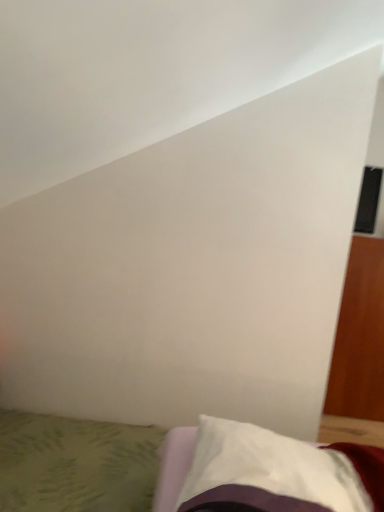
Question: Is white soft pillow at lower right in front of white fabric bed at lower center?

Choices:
 (A) yes
 (B) no

Answer: (A)

Question: Does white soft pillow at lower right turn towards white fabric bed at lower center?

Choices:
 (A) yes
 (B) no

Answer: (B)

Question: Does white soft pillow at lower right appear on the right side of white fabric bed at lower center?

Choices:
 (A) no
 (B) yes

Answer: (B)

Question: From the image's perspective, is white soft pillow at lower right on white fabric bed at lower center?

Choices:
 (A) yes
 (B) no

Answer: (A)

Question: Is white fabric bed at lower center inside white soft pillow at lower right?

Choices:
 (A) yes
 (B) no

Answer: (B)

Question: Is white soft pillow at lower right further to the viewer compared to white fabric bed at lower center?

Choices:
 (A) no
 (B) yes

Answer: (A)

Question: From the image's perspective, is white fabric bed at lower center above white soft pillow at lower right?

Choices:
 (A) yes
 (B) no

Answer: (B)

Question: Could you tell me if white fabric bed at lower center is turned towards white soft pillow at lower right?

Choices:
 (A) yes
 (B) no

Answer: (B)

Question: Is white fabric bed at lower center oriented away from white soft pillow at lower right?

Choices:
 (A) no
 (B) yes

Answer: (A)

Question: Is white fabric bed at lower center with white soft pillow at lower right?

Choices:
 (A) no
 (B) yes

Answer: (A)

Question: Can you confirm if white fabric bed at lower center is smaller than white soft pillow at lower right?

Choices:
 (A) no
 (B) yes

Answer: (A)

Question: Does white fabric bed at lower center have a greater width compared to white soft pillow at lower right?

Choices:
 (A) no
 (B) yes

Answer: (B)

Question: From the image's perspective, is white soft pillow at lower right positioned above or below white fabric bed at lower center?

Choices:
 (A) above
 (B) below

Answer: (A)